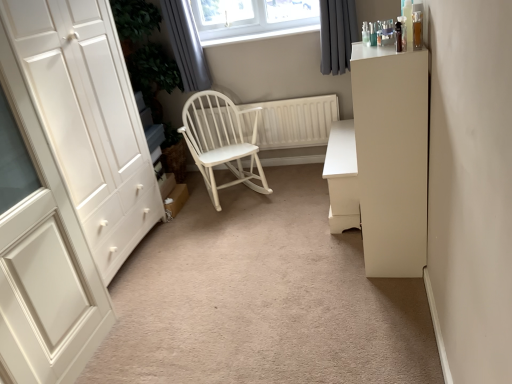
At what (x,y) coordinates should I click in order to perform the action: click on vacant space in front of white matte chest of drawers at center. Please return your answer as a coordinate pair (x, y). Image resolution: width=512 pixels, height=384 pixels. Looking at the image, I should click on (321, 248).